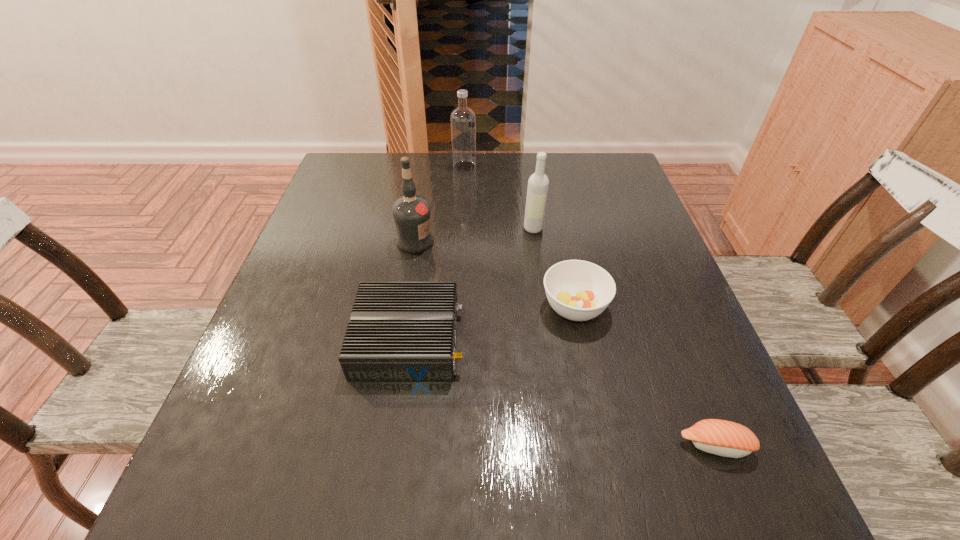
Locate an element on the screen. vacant space that satisfies the following two spatial constraints: 1. on the front side of the rightmost vodka; 2. on the front label of the leftmost vodka is located at coordinates (536, 242).

Locate an element on the screen. The image size is (960, 540). free space that satisfies the following two spatial constraints: 1. on the back side of the soup bowl; 2. on the front label of the leftmost vodka is located at coordinates (562, 242).